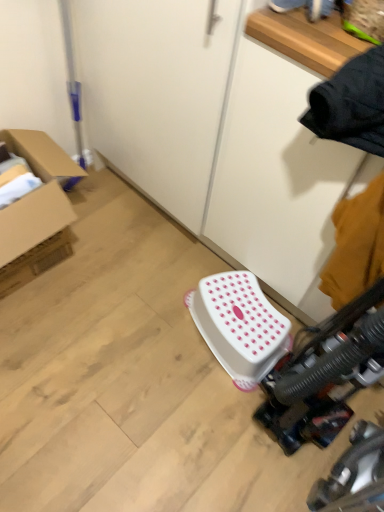
The image size is (384, 512). I want to click on free space above white plastic stool at center (from a real-world perspective), so click(x=242, y=305).